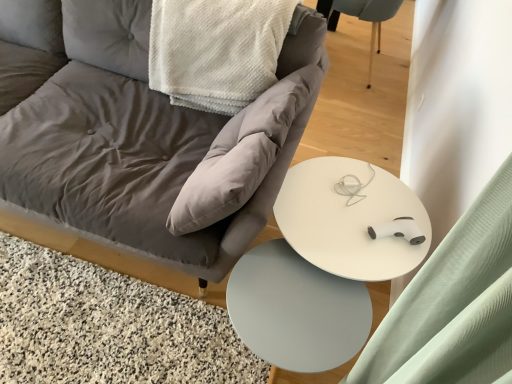
Question: Considering the positions of white glossy round table at center and matte gray fabric chair at center in the image, is white glossy round table at center wider or thinner than matte gray fabric chair at center?

Choices:
 (A) thin
 (B) wide

Answer: (A)

Question: Choose the correct answer: Is white glossy round table at center inside matte gray fabric chair at center or outside it?

Choices:
 (A) inside
 (B) outside

Answer: (B)

Question: Which is farther from the matte gray fabric chair at center?

Choices:
 (A) white glossy round table at center
 (B) white textured blanket at upper center
 (C) light blue fabric swivel chair at upper right
 (D) white matte table at center

Answer: (C)

Question: Based on their relative distances, which object is nearer to the white textured blanket at upper center?

Choices:
 (A) matte gray fabric chair at center
 (B) white matte table at center
 (C) light blue fabric swivel chair at upper right
 (D) white glossy round table at center

Answer: (A)